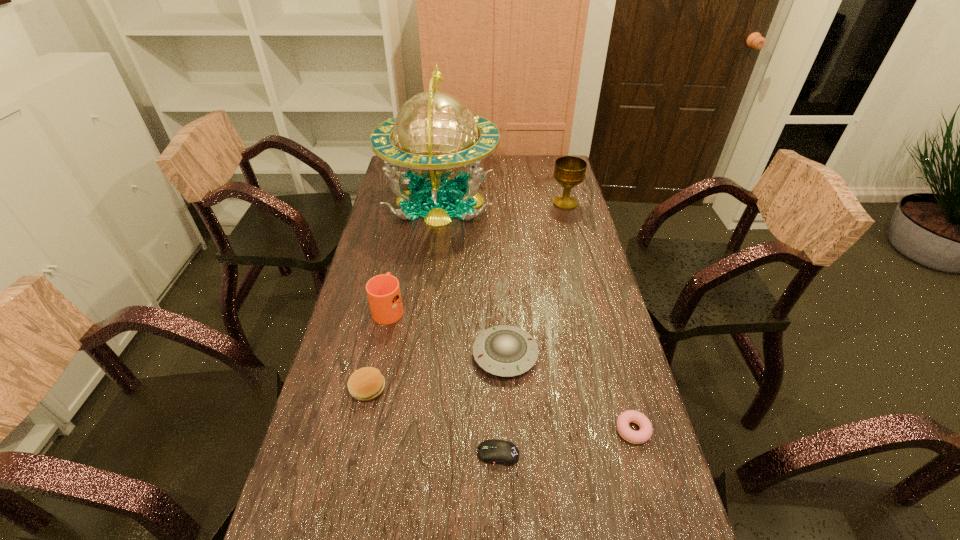
This screenshot has height=540, width=960. I want to click on patty located at the left edge, so click(x=365, y=384).

The height and width of the screenshot is (540, 960). What are the coordinates of `chalice present at the right edge` in the screenshot? It's located at (569, 172).

Identify the location of doughnut that is at the right edge. coord(645,432).

Image resolution: width=960 pixels, height=540 pixels. Find the location of `object at the far left corner`. object at the far left corner is located at coordinates (435, 134).

The height and width of the screenshot is (540, 960). I want to click on vacant region at the far edge, so click(520, 174).

In the image, there is a desktop. At what (x,y) coordinates should I click in order to perform the action: click on free space at the left edge. Please return your answer as a coordinate pair (x, y). Looking at the image, I should click on (357, 276).

This screenshot has width=960, height=540. Find the location of `free space at the right edge`. free space at the right edge is located at coordinates (586, 336).

The width and height of the screenshot is (960, 540). In order to click on free point at the far right corner in this screenshot , I will do `click(535, 176)`.

Identify the location of free space that is in between the tallest object and the patty. (404, 294).

At what (x,y) coordinates should I click in order to perform the action: click on free area in between the doughnut and the patty. Please return your answer as a coordinate pair (x, y). Looking at the image, I should click on (500, 409).